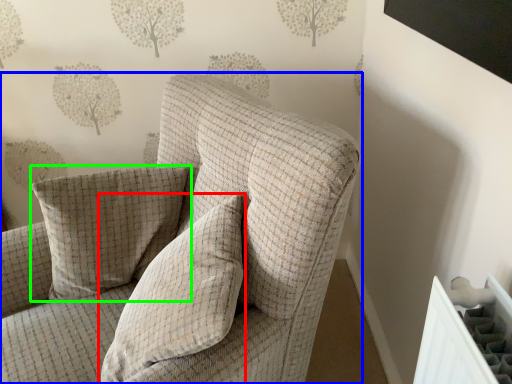
Question: Which object is positioned closest to pillow (highlighted by a red box)? Select from chair (highlighted by a blue box) and pillow (highlighted by a green box).

Choices:
 (A) chair
 (B) pillow

Answer: (A)